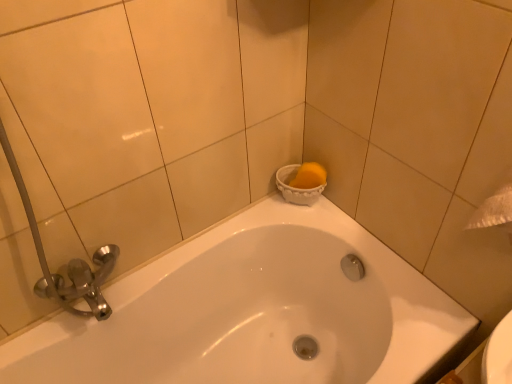
Question: Is yellow sponge at upper right wider than white glossy bathtub at upper center?

Choices:
 (A) yes
 (B) no

Answer: (B)

Question: Is yellow sponge at upper right surrounding white glossy bathtub at upper center?

Choices:
 (A) no
 (B) yes

Answer: (A)

Question: Is the position of yellow sponge at upper right more distant than that of white glossy bathtub at upper center?

Choices:
 (A) yes
 (B) no

Answer: (A)

Question: Is yellow sponge at upper right completely or partially outside of white glossy bathtub at upper center?

Choices:
 (A) no
 (B) yes

Answer: (B)

Question: From the image's perspective, is yellow sponge at upper right located above white glossy bathtub at upper center?

Choices:
 (A) yes
 (B) no

Answer: (A)

Question: Is yellow sponge at upper right turned away from white glossy bathtub at upper center?

Choices:
 (A) yes
 (B) no

Answer: (B)

Question: From a real-world perspective, is white glossy bathtub at upper center located higher than yellow sponge at upper right?

Choices:
 (A) no
 (B) yes

Answer: (A)

Question: Does white glossy bathtub at upper center have a lesser width compared to yellow sponge at upper right?

Choices:
 (A) yes
 (B) no

Answer: (B)

Question: Is white glossy bathtub at upper center smaller than yellow sponge at upper right?

Choices:
 (A) yes
 (B) no

Answer: (B)

Question: Is white glossy bathtub at upper center closer to the viewer compared to yellow sponge at upper right?

Choices:
 (A) no
 (B) yes

Answer: (B)

Question: Considering the relative sizes of white glossy bathtub at upper center and yellow sponge at upper right in the image provided, is white glossy bathtub at upper center bigger than yellow sponge at upper right?

Choices:
 (A) no
 (B) yes

Answer: (B)

Question: Is white glossy bathtub at upper center facing away from yellow sponge at upper right?

Choices:
 (A) yes
 (B) no

Answer: (B)

Question: Looking at their shapes, would you say white glossy bathtub at upper center is wider or thinner than yellow sponge at upper right?

Choices:
 (A) thin
 (B) wide

Answer: (B)